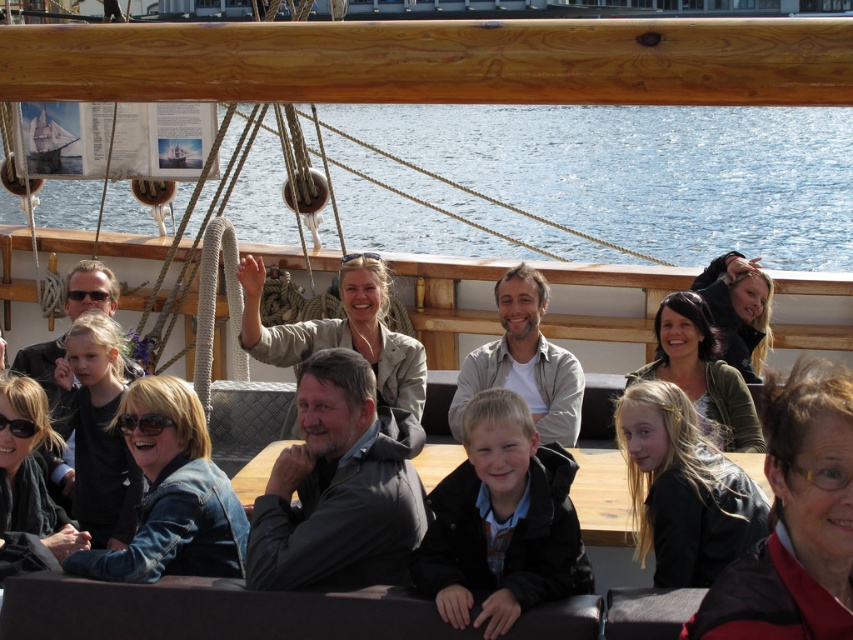
Question: Based on their relative distances, which object is nearer to the light brown wood at center?

Choices:
 (A) dark gray jacket at center
 (B) denim jacket at lower left
 (C) light brown hair at center

Answer: (A)

Question: Which object appears closest to the camera in this image?

Choices:
 (A) light brown hair at center
 (B) light brown wood at center

Answer: (A)

Question: Is blue water at upper center below denim jacket at lower left?

Choices:
 (A) no
 (B) yes

Answer: (A)

Question: Can you confirm if denim jacket at lower left is positioned to the right of light brown wood at center?

Choices:
 (A) no
 (B) yes

Answer: (A)

Question: Which object is the farthest from the denim jacket at lower left?

Choices:
 (A) light brown hair at center
 (B) light brown wood at center

Answer: (B)

Question: Is blue water at upper center further to camera compared to denim jacket at lower left?

Choices:
 (A) no
 (B) yes

Answer: (B)